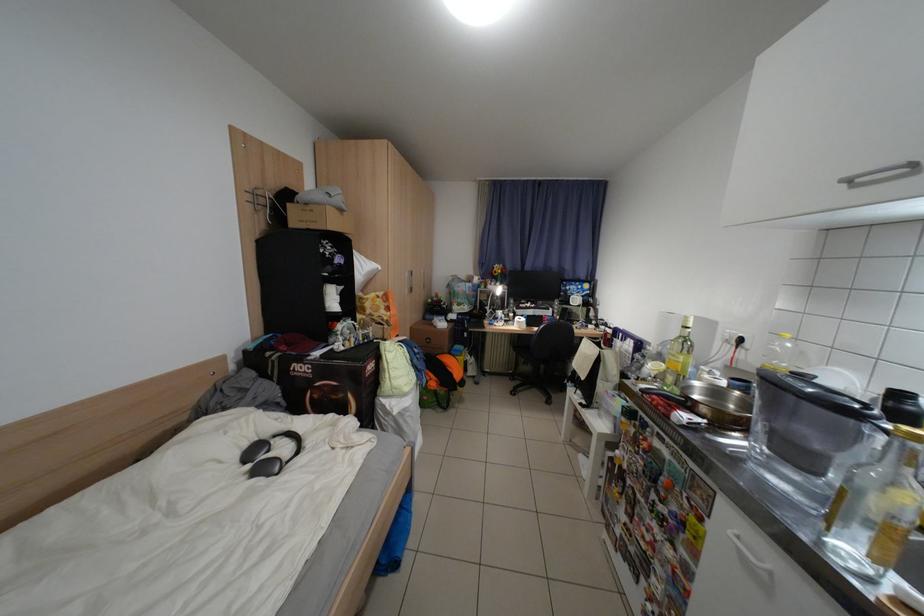
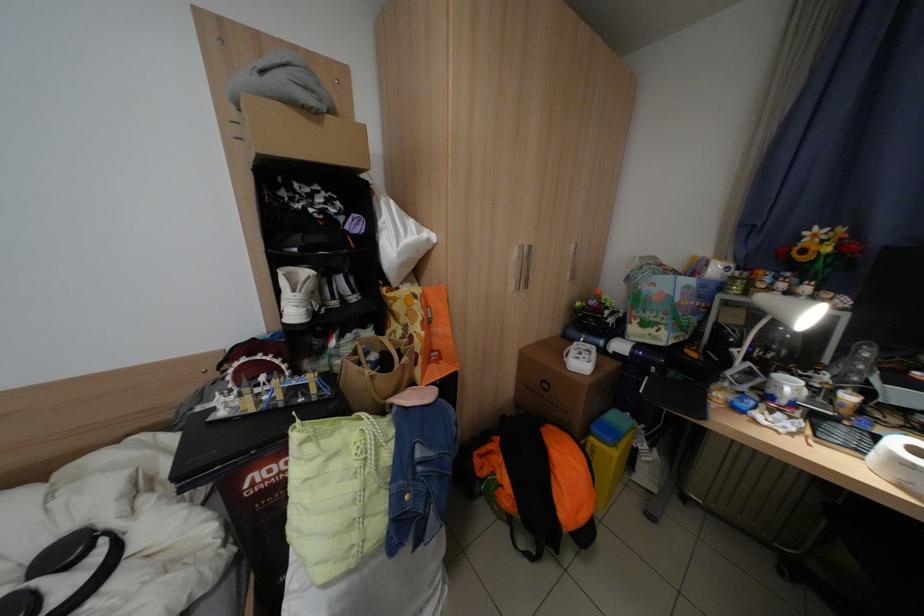
Where in the second image is the point corresponding to pixel 512 314 from the first image?

(800, 387)